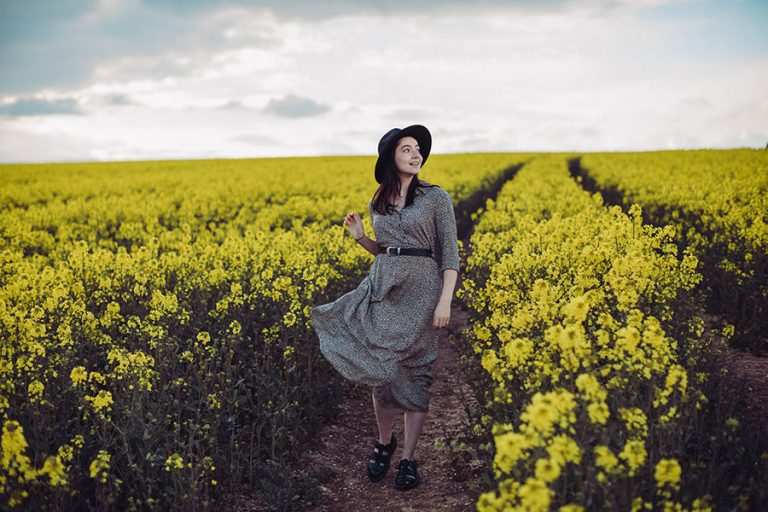
Locate an element on the screen. picture is located at coordinates (232, 242).